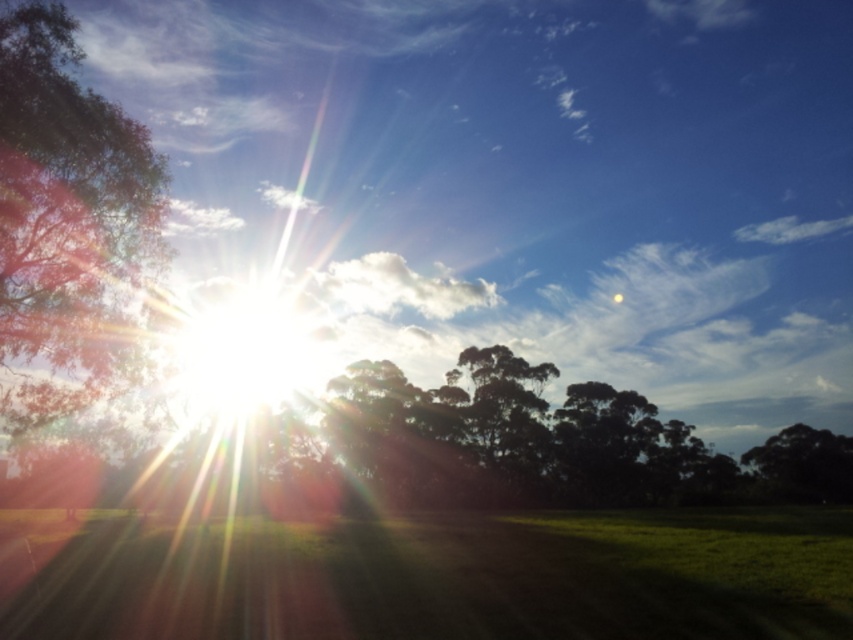
You are standing in the middle of the field and want to walk towards the green leafy tree at center. Which direction should you head?

The green leafy tree at center is located at coordinates 0.644 on the x axis and 0.596 on the y axis. Since you are in the middle of the field, you should walk towards the direction of the tree which is slightly to the right and forward from your current position.